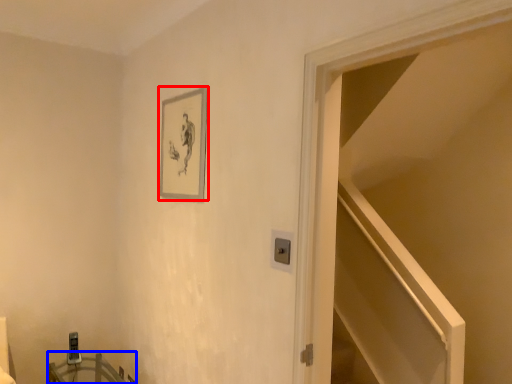
Question: Which object appears closest to the camera in this image, picture frame (highlighted by a red box) or table (highlighted by a blue box)?

Choices:
 (A) picture frame
 (B) table

Answer: (A)